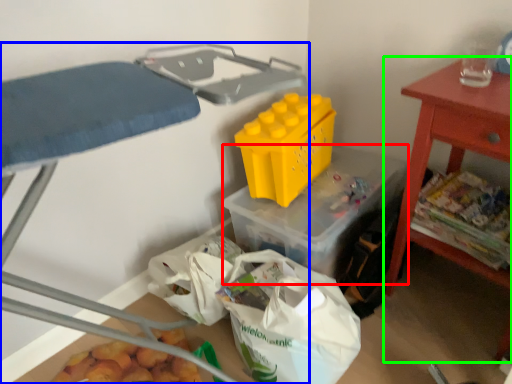
Question: Which is nearer to the storage box (highlighted by a red box)? furniture (highlighted by a blue box) or table (highlighted by a green box).

Choices:
 (A) furniture
 (B) table

Answer: (B)